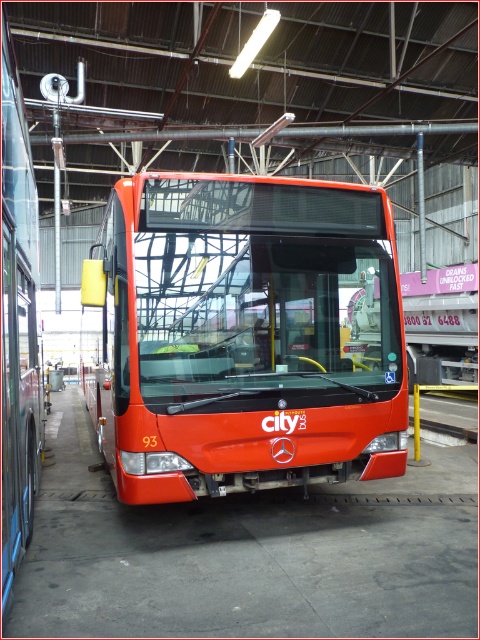
Does shiny red bus at center have a larger size compared to shiny orange bus at center?

Actually, shiny red bus at center might be smaller than shiny orange bus at center.

Does shiny red bus at center appear on the right side of shiny orange bus at center?

Yes, shiny red bus at center is to the right of shiny orange bus at center.

Where is `shiny red bus at center`? This screenshot has height=640, width=480. shiny red bus at center is located at coordinates (243, 336).